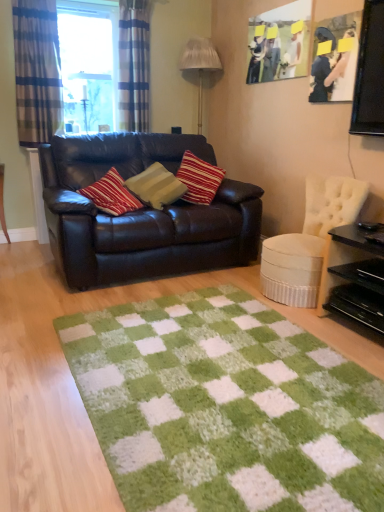
Question: Can you confirm if matte wooden picture frame at upper right, which appears as the 2th picture frame when viewed from the right, is bigger than black glossy table at right?

Choices:
 (A) no
 (B) yes

Answer: (A)

Question: Considering the relative sizes of matte wooden picture frame at upper right, which ranks as the second picture frame in front-to-back order, and black glossy table at right in the image provided, is matte wooden picture frame at upper right, which ranks as the second picture frame in front-to-back order, wider than black glossy table at right?

Choices:
 (A) yes
 (B) no

Answer: (B)

Question: Is matte wooden picture frame at upper right, the 1th picture frame viewed from the back, positioned with its back to black glossy table at right?

Choices:
 (A) yes
 (B) no

Answer: (B)

Question: Is matte wooden picture frame at upper right, which ranks as the 1th picture frame in left-to-right order, shorter than black glossy table at right?

Choices:
 (A) no
 (B) yes

Answer: (A)

Question: Does matte wooden picture frame at upper right, which ranks as the 1th picture frame in left-to-right order, come in front of black glossy table at right?

Choices:
 (A) yes
 (B) no

Answer: (B)

Question: Could you tell me if matte wooden picture frame at upper right, which appears as the 2th picture frame when viewed from the right, is facing black glossy table at right?

Choices:
 (A) no
 (B) yes

Answer: (A)

Question: From the image's perspective, is white pleated fabric lampshade at upper center located above clear glass window at upper left?

Choices:
 (A) no
 (B) yes

Answer: (A)

Question: Is white pleated fabric lampshade at upper center shorter than clear glass window at upper left?

Choices:
 (A) no
 (B) yes

Answer: (A)

Question: From the image's perspective, is white pleated fabric lampshade at upper center below clear glass window at upper left?

Choices:
 (A) no
 (B) yes

Answer: (B)

Question: Can you confirm if white pleated fabric lampshade at upper center is bigger than clear glass window at upper left?

Choices:
 (A) yes
 (B) no

Answer: (A)

Question: Is white pleated fabric lampshade at upper center oriented away from clear glass window at upper left?

Choices:
 (A) no
 (B) yes

Answer: (A)

Question: From a real-world perspective, is white pleated fabric lampshade at upper center positioned over clear glass window at upper left based on gravity?

Choices:
 (A) yes
 (B) no

Answer: (B)

Question: Would you say matte black couch at center contains striped fabric pillow at center?

Choices:
 (A) no
 (B) yes

Answer: (B)